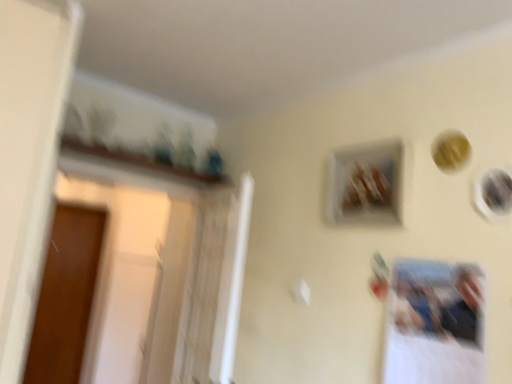
Question: Can you confirm if brown wood screen door at left is positioned to the left of wooden frame at upper center, placed as the 2th picture frame when sorted from front to back?

Choices:
 (A) no
 (B) yes

Answer: (B)

Question: From the image's perspective, would you say brown wood screen door at left is shown under wooden frame at upper center, placed as the 2th picture frame when sorted from front to back?

Choices:
 (A) no
 (B) yes

Answer: (B)

Question: From a real-world perspective, is brown wood screen door at left on top of wooden frame at upper center, the 2th picture frame from the right?

Choices:
 (A) yes
 (B) no

Answer: (B)

Question: Can you confirm if brown wood screen door at left is shorter than wooden frame at upper center, placed as the 2th picture frame when sorted from front to back?

Choices:
 (A) yes
 (B) no

Answer: (B)

Question: Is brown wood screen door at left oriented towards wooden frame at upper center, the 1th picture frame from the back?

Choices:
 (A) no
 (B) yes

Answer: (B)

Question: In terms of size, does matte black picture frame at upper right, which ranks as the 2th picture frame in back-to-front order, appear bigger or smaller than wooden frame at upper center, the 1th picture frame from the back?

Choices:
 (A) small
 (B) big

Answer: (A)

Question: Is matte black picture frame at upper right, arranged as the first picture frame when viewed from the right, in front of or behind wooden frame at upper center, the 1th picture frame from the back, in the image?

Choices:
 (A) front
 (B) behind

Answer: (A)

Question: Is matte black picture frame at upper right, arranged as the first picture frame when viewed from the right, taller or shorter than wooden frame at upper center, the 1th picture frame from the back?

Choices:
 (A) short
 (B) tall

Answer: (A)

Question: From a real-world perspective, is matte black picture frame at upper right, arranged as the first picture frame when viewed from the right, positioned above or below wooden frame at upper center, the 2th picture frame from the right?

Choices:
 (A) above
 (B) below

Answer: (B)

Question: Do you think wooden frame at upper center, the first picture frame from the left, is within matte black picture frame at upper right, arranged as the first picture frame when viewed from the right, or outside of it?

Choices:
 (A) outside
 (B) inside

Answer: (A)

Question: Considering the positions of wooden frame at upper center, the first picture frame from the left, and matte black picture frame at upper right, the 2th picture frame viewed from the left, in the image, is wooden frame at upper center, the first picture frame from the left, bigger or smaller than matte black picture frame at upper right, the 2th picture frame viewed from the left,?

Choices:
 (A) small
 (B) big

Answer: (B)

Question: Based on their positions, is wooden frame at upper center, the 1th picture frame from the back, located to the left or right of matte black picture frame at upper right, which ranks as the 2th picture frame in back-to-front order?

Choices:
 (A) left
 (B) right

Answer: (A)

Question: Looking at their shapes, would you say wooden frame at upper center, the 2th picture frame from the right, is wider or thinner than matte black picture frame at upper right, which ranks as the 2th picture frame in back-to-front order?

Choices:
 (A) thin
 (B) wide

Answer: (B)

Question: Looking at the image, does brown wood screen door at left seem bigger or smaller compared to matte black picture frame at upper right, the 2th picture frame viewed from the left?

Choices:
 (A) small
 (B) big

Answer: (B)

Question: Visually, is brown wood screen door at left positioned to the left or to the right of matte black picture frame at upper right, arranged as the first picture frame when viewed from the right?

Choices:
 (A) right
 (B) left

Answer: (B)